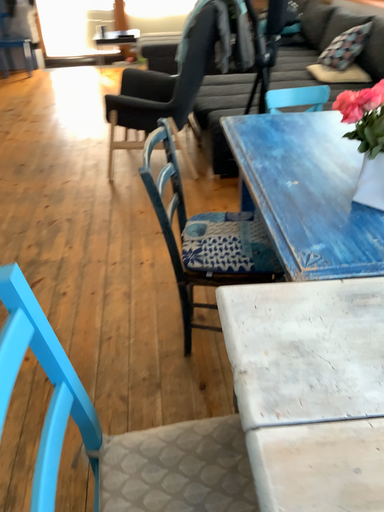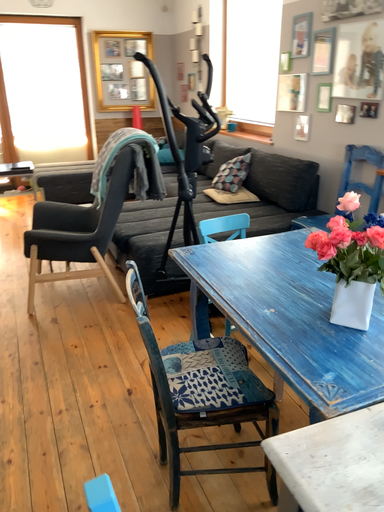
Question: Which way did the camera rotate in the video?

Choices:
 (A) rotated right
 (B) rotated left

Answer: (A)